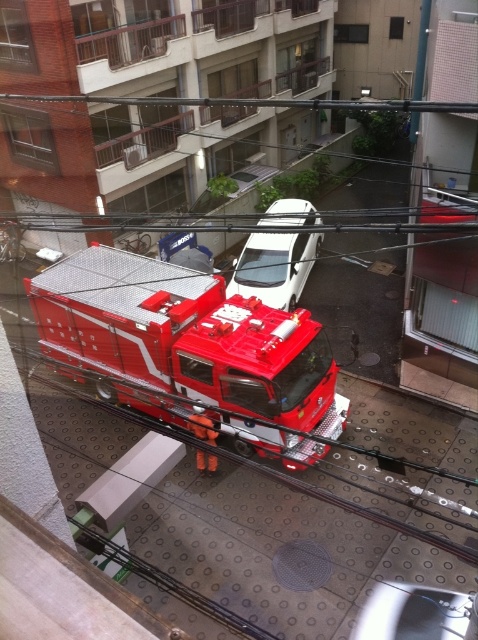
You are a delivery driver who needs to pass through the street where the white matte van at center and the metallic silver car at center are parked. Can you drive around them without moving either vehicle?

The metallic silver car at center is behind the white matte van at center, so you can drive around them by going around the white matte van at center since the metallic silver car at center is not blocking the path in front.

You are a delivery driver who needs to park your truck, which is 2 meters wide, in the parking lot. You see the metallic red fire truck at center and the white matte van at center. Which vehicle has a narrower width, allowing your truck to fit alongside it?

The metallic red fire truck at center is thinner than the white matte van at center, so your truck can fit alongside the metallic red fire truck at center since it has a narrower width.

You are a delivery driver who needs to park your truck between the white matte van at center and the metallic silver car at center. Your truck is 15 feet long. Is there enough space between them to park your truck?

The white matte van at center and the metallic silver car at center are 29.45 feet apart. Since your truck is 15 feet long, there is sufficient space between them to park your truck.